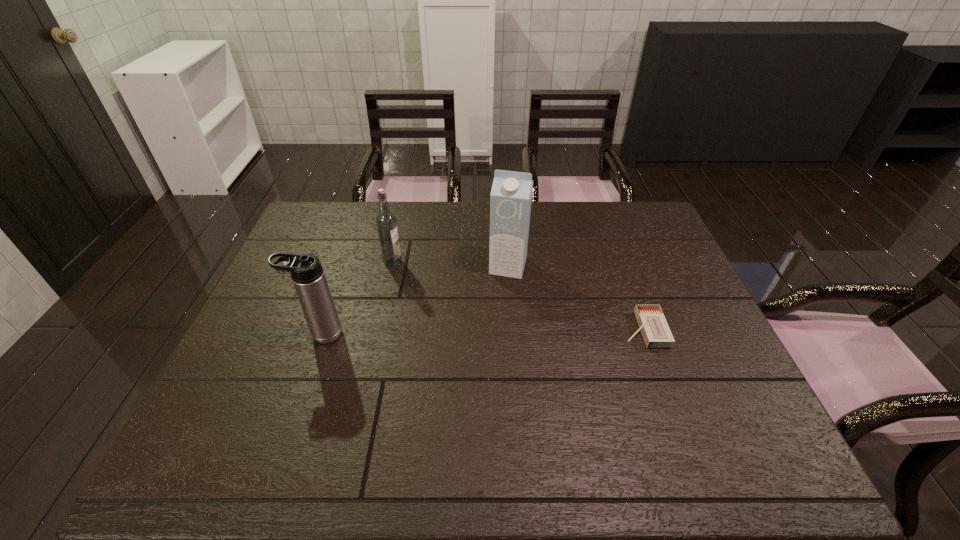
Where is `unoccupied area between the third object from right to left and the matchbox`? The height and width of the screenshot is (540, 960). unoccupied area between the third object from right to left and the matchbox is located at coordinates (518, 296).

You are a GUI agent. You are given a task and a screenshot of the screen. Output one action in this format:
    pyautogui.click(x=<x>, y=<y>)
    Task: Click on the free space between the vodka and the matchbox
    This screenshot has width=960, height=540.
    Given the screenshot: What is the action you would take?
    pyautogui.click(x=518, y=296)

Locate an element on the screen. The image size is (960, 540). free spot between the third object from left to right and the second object from left to right is located at coordinates point(450,264).

You are a GUI agent. You are given a task and a screenshot of the screen. Output one action in this format:
    pyautogui.click(x=<x>, y=<y>)
    Task: Click on the unoccupied position between the carton and the thermos bottle
    The height and width of the screenshot is (540, 960).
    Given the screenshot: What is the action you would take?
    [x=415, y=300]

In order to click on free space between the carton and the leftmost object in this screenshot , I will do `click(415, 300)`.

In order to click on unoccupied position between the tallest object and the leftmost object in this screenshot , I will do `click(415, 300)`.

The image size is (960, 540). What are the coordinates of `the second closest object to the shortest object` in the screenshot? It's located at (386, 221).

Find the location of a particular element. object that is the closest to the shortest object is located at coordinates (510, 200).

You are a GUI agent. You are given a task and a screenshot of the screen. Output one action in this format:
    pyautogui.click(x=<x>, y=<y>)
    Task: Click on the free space that satisfies the following two spatial constraints: 1. on the front side of the shortest object; 2. on the striking surface of the vodka
    The height and width of the screenshot is (540, 960).
    Given the screenshot: What is the action you would take?
    coord(378,329)

This screenshot has width=960, height=540. I want to click on free space in the image that satisfies the following two spatial constraints: 1. on the front side of the carton; 2. on the striking surface of the matchbox, so click(513, 329).